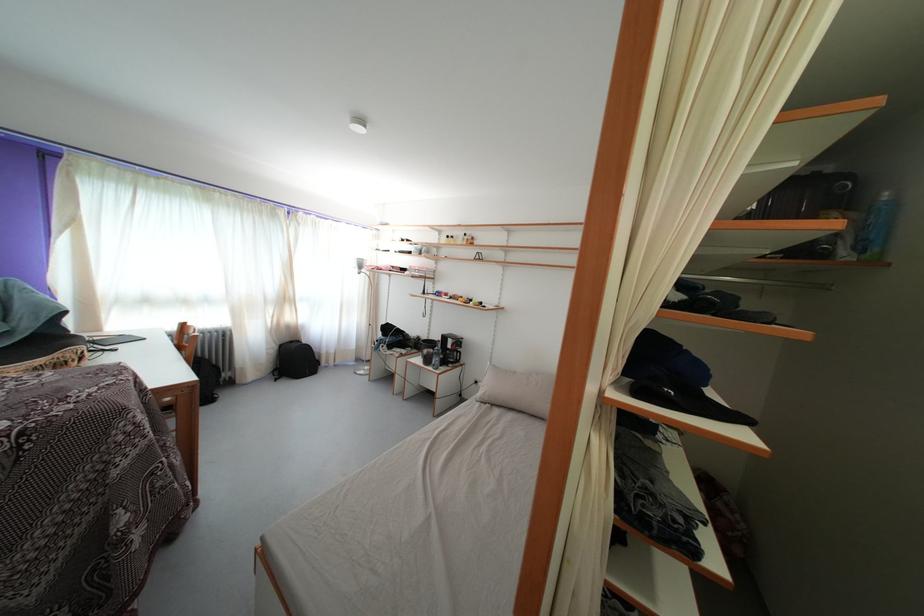
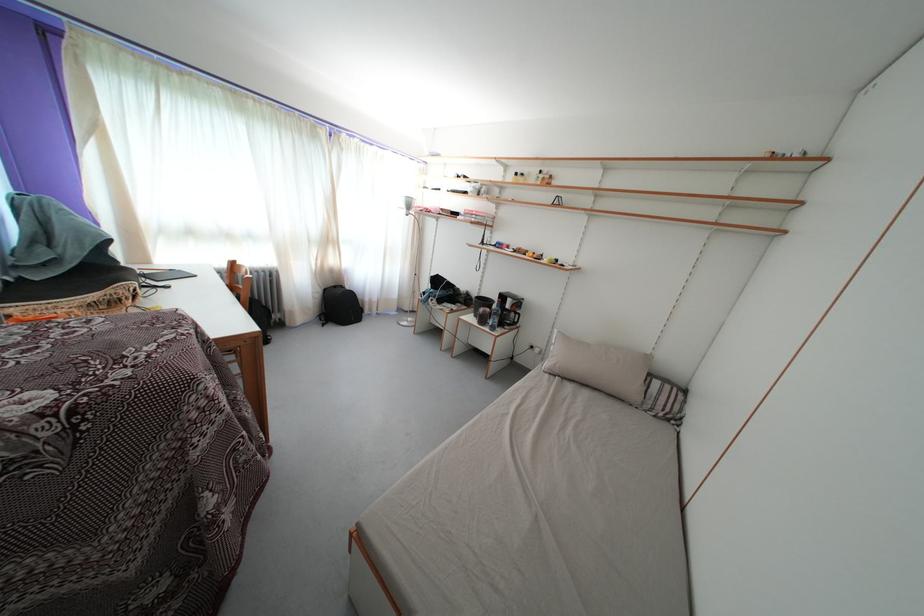
Question: How did the camera likely rotate?

Choices:
 (A) Left
 (B) Right
 (C) Up
 (D) Down

Answer: (D)